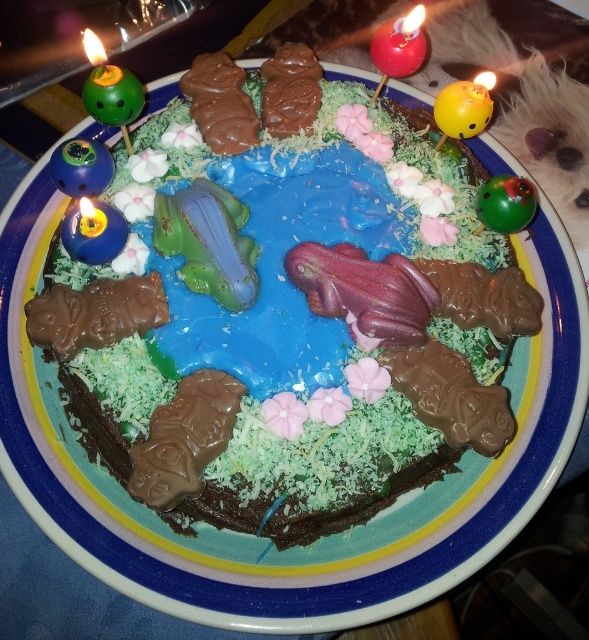
Question: Can you confirm if green matte candle at upper left is bigger than shiny red candle at upper center?

Choices:
 (A) yes
 (B) no

Answer: (B)

Question: Can you confirm if green matte candle at upper left is bigger than shiny red candle at upper center?

Choices:
 (A) no
 (B) yes

Answer: (A)

Question: Among these points, which one is nearest to the camera?

Choices:
 (A) (403, 236)
 (B) (380, 77)
 (C) (110, 97)

Answer: (C)

Question: Which point is farther to the camera?

Choices:
 (A) chocolate cake at center
 (B) shiny red candle at upper center
 (C) green matte candle at upper left

Answer: (B)

Question: Which point is farther to the camera?

Choices:
 (A) green matte candle at upper left
 (B) chocolate cake at center

Answer: (A)

Question: Is green matte candle at upper left above shiny red candle at upper center?

Choices:
 (A) no
 (B) yes

Answer: (A)